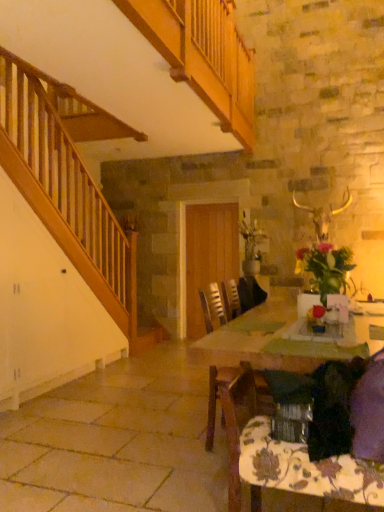
You are a GUI agent. You are given a task and a screenshot of the screen. Output one action in this format:
    pyautogui.click(x=<x>, y=<y>)
    Task: Click on the wooden chair at center
    Image resolution: width=384 pixels, height=512 pixels.
    Given the screenshot: What is the action you would take?
    pyautogui.click(x=219, y=303)

Locate an element on the screen. This screenshot has height=512, width=384. wooden chair at center is located at coordinates (219, 303).

Can you tell me how much floral-patterned fabric at lower right and wooden table at center differ in facing direction?

The angle between the facing direction of floral-patterned fabric at lower right and the facing direction of wooden table at center is 179 degrees.

Measure the distance from floral-patterned fabric at lower right to wooden table at center.

floral-patterned fabric at lower right and wooden table at center are 20.88 inches apart.

Consider the image. Is floral-patterned fabric at lower right facing towards wooden table at center?

Yes, floral-patterned fabric at lower right is turned towards wooden table at center.

Does floral-patterned fabric at lower right have a lesser width compared to wooden table at center?

Indeed, floral-patterned fabric at lower right has a lesser width compared to wooden table at center.

Is wooden table at center oriented towards wooden chair at center?

No.

Would you say wooden table at center is inside or outside wooden chair at center?

wooden table at center lies outside wooden chair at center.

Locate an element on the screen. This screenshot has width=384, height=512. table that is under the wooden chair at center (from a real-world perspective) is located at coordinates (277, 339).

Which of these two, wooden table at center or wooden chair at center, is thinner?

Thinner between the two is wooden chair at center.

Is wooden chair at center thinner than floral-patterned fabric at lower right?

No.

Between wooden chair at center and floral-patterned fabric at lower right, which one is positioned behind?

Positioned behind is wooden chair at center.

Is wooden chair at center shorter than floral-patterned fabric at lower right?

No, wooden chair at center is not shorter than floral-patterned fabric at lower right.

Identify the location of tablecloth below the wooden chair at center (from the image's perspective). The width and height of the screenshot is (384, 512). (303, 470).

Can you confirm if wooden table at center is thinner than floral-patterned fabric at lower right?

In fact, wooden table at center might be wider than floral-patterned fabric at lower right.

Are wooden table at center and floral-patterned fabric at lower right located far from each other?

wooden table at center is actually quite close to floral-patterned fabric at lower right.

Considering the sizes of objects wooden table at center and floral-patterned fabric at lower right in the image provided, who is taller, wooden table at center or floral-patterned fabric at lower right?

wooden table at center is taller.

From a real-world perspective, which object rests below the other?

From a 3D spatial view, floral-patterned fabric at lower right is below.

Is wooden table at center inside wooden chair at center?

No, wooden table at center is located outside of wooden chair at center.

Based on the photo, considering the sizes of objects wooden chair at center and wooden table at center in the image provided, who is wider, wooden chair at center or wooden table at center?

Wider between the two is wooden table at center.

From a real-world perspective, is wooden chair at center physically below wooden table at center?

No.

Which object is further away from the camera taking this photo, wooden chair at center or wooden table at center?

Positioned behind is wooden chair at center.

Can you confirm if floral-patterned fabric at lower right is taller than wooden chair at center?

No, floral-patterned fabric at lower right is not taller than wooden chair at center.

From a real-world perspective, is floral-patterned fabric at lower right physically below wooden chair at center?

Correct, in the physical world, floral-patterned fabric at lower right is lower than wooden chair at center.

Choose the correct answer: Is floral-patterned fabric at lower right inside wooden chair at center or outside it?

floral-patterned fabric at lower right is not enclosed by wooden chair at center.

In the scene shown: Is floral-patterned fabric at lower right aimed at wooden chair at center?

Yes, floral-patterned fabric at lower right faces towards wooden chair at center.

Locate an element on the screen. The width and height of the screenshot is (384, 512). table above the floral-patterned fabric at lower right (from the image's perspective) is located at coordinates (277, 339).

Where is `table in front of the wooden chair at center`? table in front of the wooden chair at center is located at coordinates (277, 339).

From the picture: From the image, which object appears to be nearer to floral-patterned fabric at lower right, wooden chair at center or wooden table at center?

Among the two, wooden chair at center is located nearer to floral-patterned fabric at lower right.

Which object lies nearer to the anchor point wooden table at center, wooden chair at center or floral-patterned fabric at lower right?

Based on the image, wooden chair at center appears to be nearer to wooden table at center.

Which object lies further to the anchor point wooden chair at center, floral-patterned fabric at lower right or wooden table at center?

floral-patterned fabric at lower right lies further to wooden chair at center than the other object.

Looking at the image, which one is located closer to wooden table at center, floral-patterned fabric at lower right or wooden chair at center?

wooden chair at center is positioned closer to the anchor wooden table at center.

Looking at the image, which one is located closer to wooden chair at center, wooden table at center or floral-patterned fabric at lower right?

Among the two, wooden table at center is located nearer to wooden chair at center.

Based on their spatial positions, is wooden table at center or wooden chair at center closer to floral-patterned fabric at lower right?

The object closer to floral-patterned fabric at lower right is wooden chair at center.

You are a GUI agent. You are given a task and a screenshot of the screen. Output one action in this format:
    pyautogui.click(x=<x>, y=<y>)
    Task: Click on the table positioned between floral-patterned fabric at lower right and wooden chair at center from near to far
    The height and width of the screenshot is (512, 384).
    Given the screenshot: What is the action you would take?
    pyautogui.click(x=277, y=339)